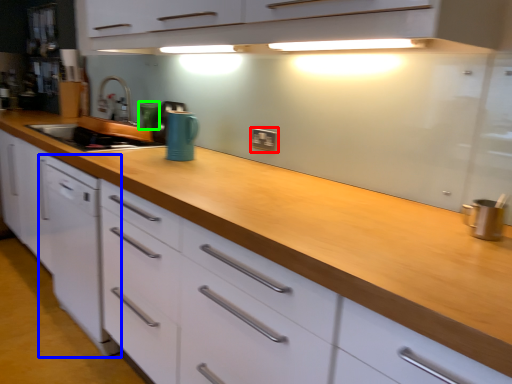
Question: Which object is positioned closest to electric outlet (highlighted by a red box)? Select from home appliance (highlighted by a blue box) and appliance (highlighted by a green box).

Choices:
 (A) home appliance
 (B) appliance

Answer: (B)